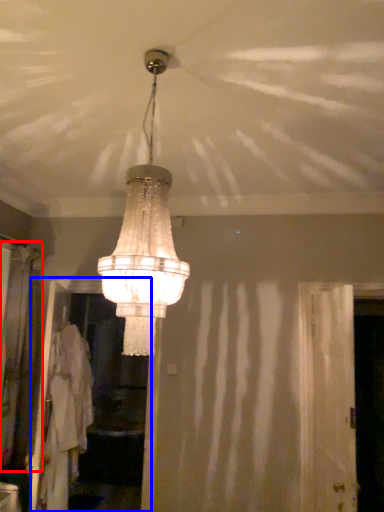
Question: Which object is further to the camera taking this photo, curtain (highlighted by a red box) or screen door (highlighted by a blue box)?

Choices:
 (A) curtain
 (B) screen door

Answer: (B)